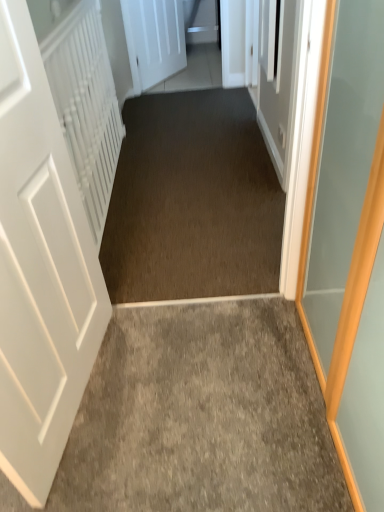
Question: Is white textured radiator at left oriented towards white matte door at left, the second door positioned from the back?

Choices:
 (A) yes
 (B) no

Answer: (B)

Question: Can you confirm if white textured radiator at left is bigger than white matte door at left, the second door positioned from the back?

Choices:
 (A) no
 (B) yes

Answer: (B)

Question: From a real-world perspective, is white textured radiator at left physically below white matte door at left, the first door from the front?

Choices:
 (A) no
 (B) yes

Answer: (B)

Question: Is white textured radiator at left thinner than white matte door at left, which is the 2th door from top to bottom?

Choices:
 (A) yes
 (B) no

Answer: (A)

Question: From the image's perspective, is white textured radiator at left located above white matte door at left, which is the 2th door from top to bottom?

Choices:
 (A) no
 (B) yes

Answer: (B)

Question: Is white textured radiator at left not inside white matte door at left, which is the 2th door from top to bottom?

Choices:
 (A) no
 (B) yes

Answer: (B)

Question: From the image's perspective, is white matte door at upper center, acting as the 1th door starting from the top, above white matte door at left, the first door from the front?

Choices:
 (A) no
 (B) yes

Answer: (B)

Question: Can you confirm if white matte door at upper center, acting as the 1th door starting from the top, is wider than white matte door at left, the 1th door in the bottom-to-top sequence?

Choices:
 (A) yes
 (B) no

Answer: (B)

Question: Is white matte door at upper center, which appears as the second door when viewed from the front, looking in the opposite direction of white matte door at left, the first door from the front?

Choices:
 (A) no
 (B) yes

Answer: (A)

Question: Can you confirm if white matte door at upper center, which appears as the second door when viewed from the front, is taller than white matte door at left, the second door positioned from the back?

Choices:
 (A) no
 (B) yes

Answer: (A)

Question: Can you confirm if white matte door at upper center, which appears as the second door when viewed from the front, is shorter than white matte door at left, which is the 2th door from top to bottom?

Choices:
 (A) no
 (B) yes

Answer: (B)

Question: Can you confirm if white matte door at upper center, acting as the 2th door starting from the bottom, is positioned to the left of white matte door at left, the 1th door in the bottom-to-top sequence?

Choices:
 (A) no
 (B) yes

Answer: (A)

Question: Is gray carpet at center thinner than white textured radiator at left?

Choices:
 (A) yes
 (B) no

Answer: (B)